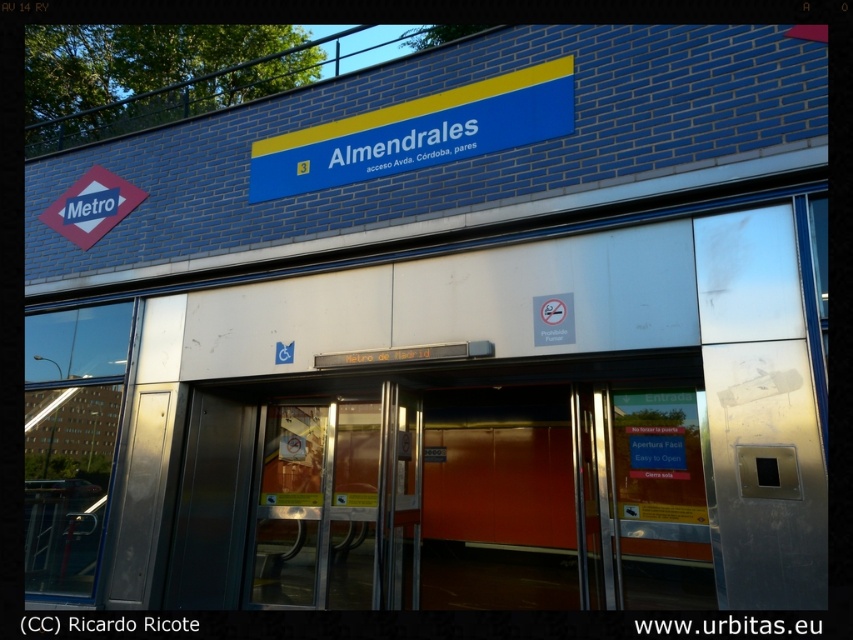
Question: Based on their relative distances, which object is nearer to the matte red diamond at upper left?

Choices:
 (A) transparent glass door at center
 (B) blue plastic sign at upper center

Answer: (B)

Question: Which object is positioned farthest from the matte red diamond at upper left?

Choices:
 (A) transparent glass door at center
 (B) blue plastic sign at upper center

Answer: (A)

Question: Which object appears farthest from the camera in this image?

Choices:
 (A) blue plastic sign at upper center
 (B) transparent glass door at center

Answer: (B)

Question: Is transparent glass door at center bigger than blue plastic sign at upper center?

Choices:
 (A) yes
 (B) no

Answer: (B)

Question: Where is blue plastic sign at upper center located in relation to matte red diamond at upper left in the image?

Choices:
 (A) below
 (B) above

Answer: (B)

Question: Where is transparent glass door at center located in relation to matte red diamond at upper left in the image?

Choices:
 (A) above
 (B) below

Answer: (B)